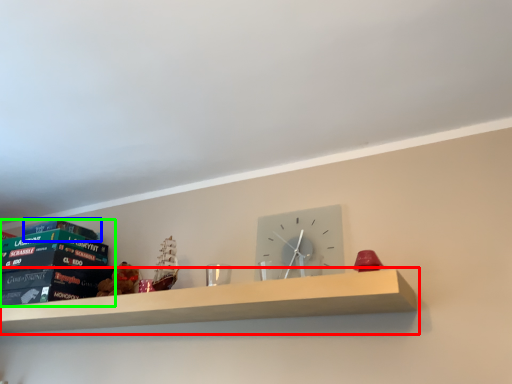
Question: Which object is the closest to the shelf (highlighted by a red box)? Choose among these: paperback book (highlighted by a blue box) or paperback book (highlighted by a green box).

Choices:
 (A) paperback book
 (B) paperback book

Answer: (B)